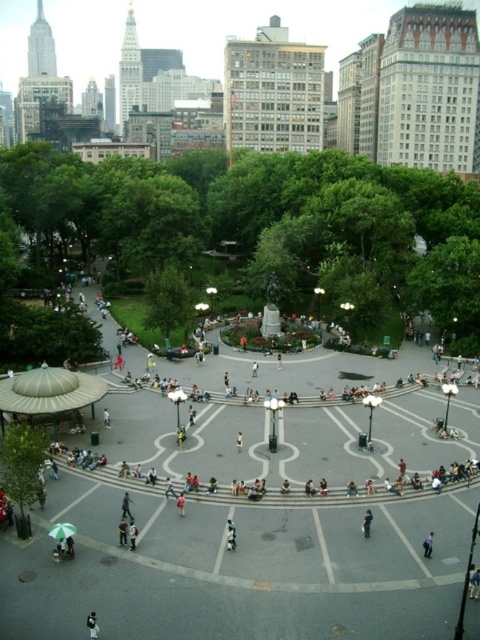
Question: Where is light brown leather jacket at center located in relation to dark blue fabric at center in the image?

Choices:
 (A) left
 (B) right

Answer: (A)

Question: Which of the following is the farthest from the observer?

Choices:
 (A) (93, 612)
 (B) (369, 522)
 (C) (128, 502)
 (D) (181, 499)

Answer: (D)

Question: Among these points, which one is farthest from the camera?

Choices:
 (A) (180, 493)
 (B) (131, 515)
 (C) (432, 540)
 (D) (94, 614)

Answer: (A)

Question: Which of these objects is positioned closest to the light blue shirt at lower right?

Choices:
 (A) dark blue fabric at center
 (B) light brown leather jacket at center
 (C) dark gray fabric jacket at center

Answer: (A)

Question: Does light brown leather jacket at center have a smaller size compared to dark blue fabric at center?

Choices:
 (A) yes
 (B) no

Answer: (A)

Question: In this image, where is white cotton shirt at center located relative to dark gray fabric jacket at center?

Choices:
 (A) right
 (B) left

Answer: (A)